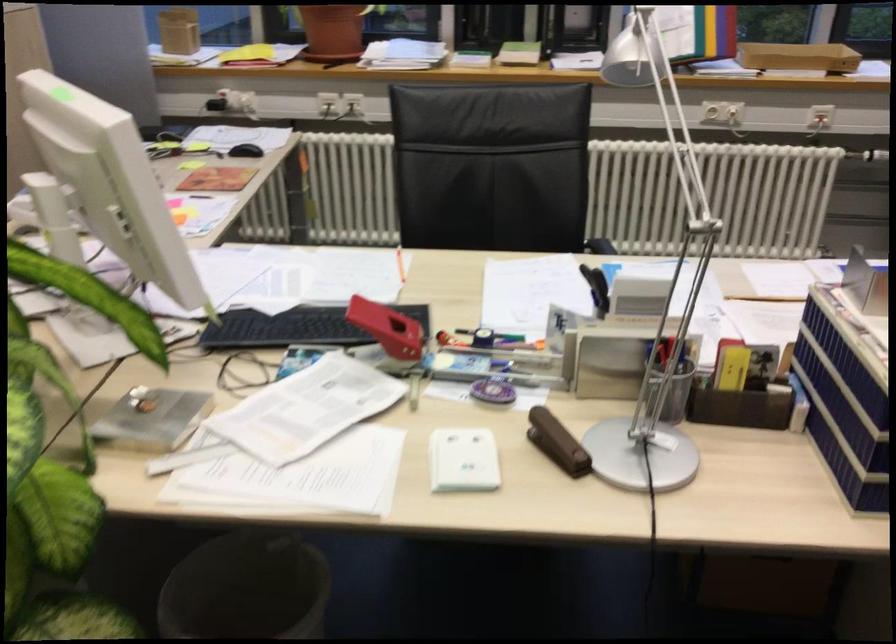
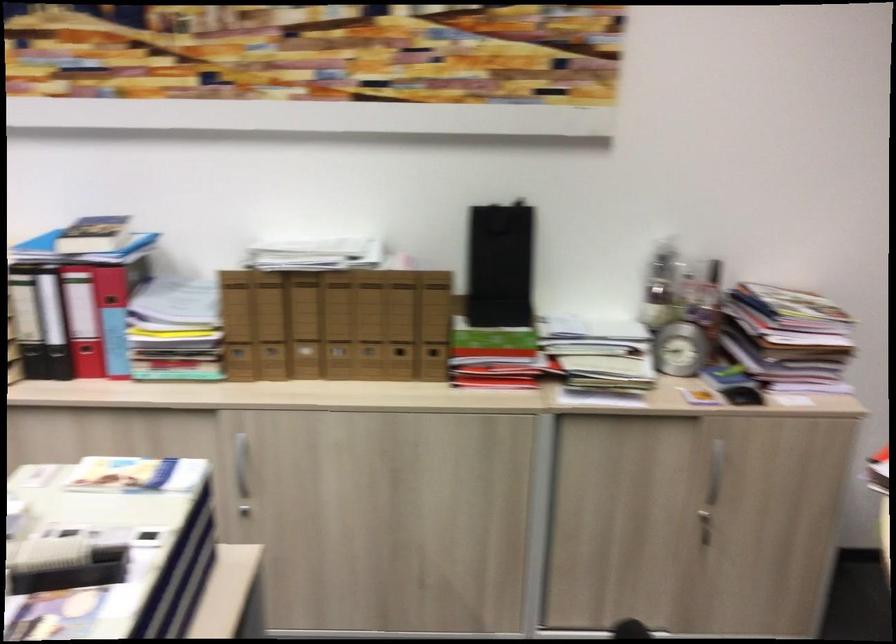
How did the camera likely rotate?

The camera rotated toward right-down.